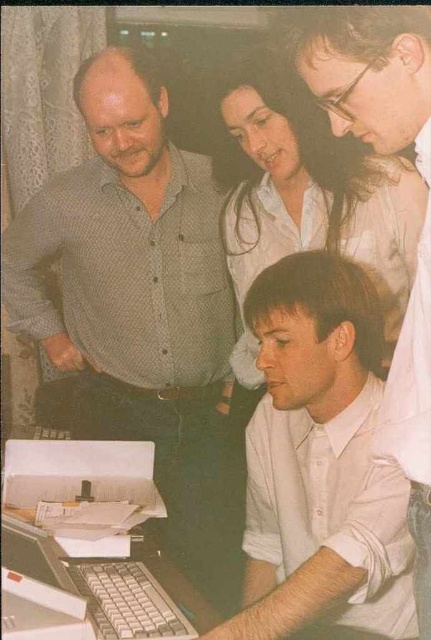
Who is taller, gray dotted shirt at left or white plastic laptop at lower left?

gray dotted shirt at left

What do you see at coordinates (137, 300) in the screenshot?
I see `gray dotted shirt at left` at bounding box center [137, 300].

Which is in front, point (93, 243) or point (12, 524)?

Positioned in front is point (12, 524).

Find the location of a particular element. This screenshot has height=640, width=431. gray dotted shirt at left is located at coordinates (137, 300).

Is gray dotted shirt at left smaller than white glossy shirt at center?

Actually, gray dotted shirt at left might be larger than white glossy shirt at center.

Is gray dotted shirt at left bigger than white glossy shirt at center?

Indeed, gray dotted shirt at left has a larger size compared to white glossy shirt at center.

Is point (172, 476) in front of point (383, 51)?

That is False.

You are a GUI agent. You are given a task and a screenshot of the screen. Output one action in this format:
    pyautogui.click(x=<x>, y=<y>)
    Task: Click on the gray dotted shirt at left
    
    Given the screenshot: What is the action you would take?
    tap(137, 300)

Is point (422, 252) more distant than point (9, 556)?

No.

Locate an element on the screen. This screenshot has height=640, width=431. white glossy shirt at center is located at coordinates (427, 204).

Identify the location of white glossy shirt at center. The image size is (431, 640). (427, 204).

Locate an element on the screen. white glossy shirt at center is located at coordinates (427, 204).